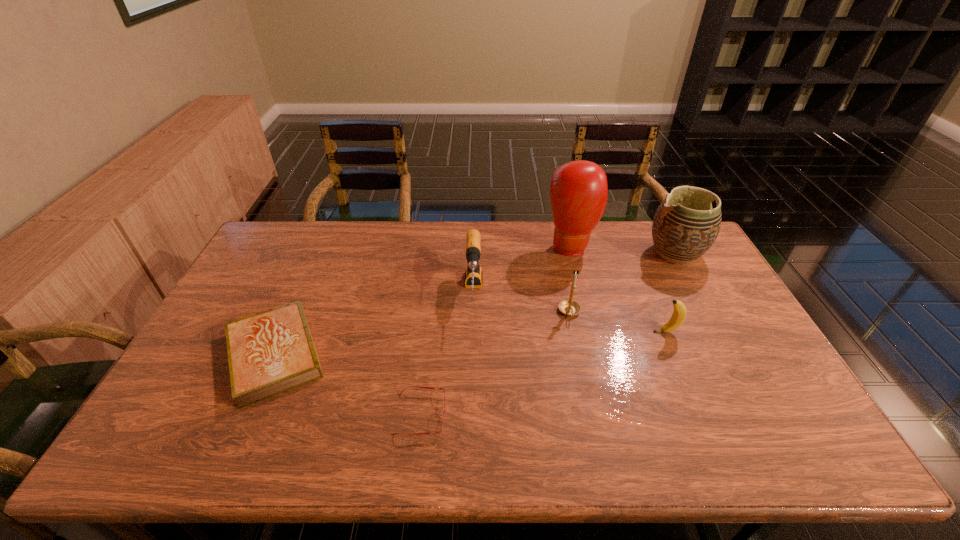
Locate an element on the screen. The height and width of the screenshot is (540, 960). boxing glove that is positioned at the far edge is located at coordinates (578, 191).

The height and width of the screenshot is (540, 960). I want to click on pottery located in the far edge section of the desktop, so click(x=685, y=226).

The height and width of the screenshot is (540, 960). I want to click on object that is at the near edge, so click(x=410, y=386).

The width and height of the screenshot is (960, 540). What are the coordinates of `object that is at the left edge` in the screenshot? It's located at (269, 352).

Find the location of a particular element. The height and width of the screenshot is (540, 960). object that is at the right edge is located at coordinates (685, 226).

Where is `object situated at the far right corner`? This screenshot has width=960, height=540. object situated at the far right corner is located at coordinates (685, 226).

The width and height of the screenshot is (960, 540). In the image, there is a desktop. Identify the location of vacant space at the far edge. (385, 223).

In the image, there is a desktop. In order to click on blank space at the near edge in this screenshot , I will do `click(500, 427)`.

In the image, there is a desktop. Where is `free space at the left edge`? The width and height of the screenshot is (960, 540). free space at the left edge is located at coordinates (194, 374).

You are a GUI agent. You are given a task and a screenshot of the screen. Output one action in this format:
    pyautogui.click(x=<x>, y=<y>)
    Task: Click on the free space at the right edge
    The image size is (960, 540).
    Given the screenshot: What is the action you would take?
    pyautogui.click(x=708, y=338)